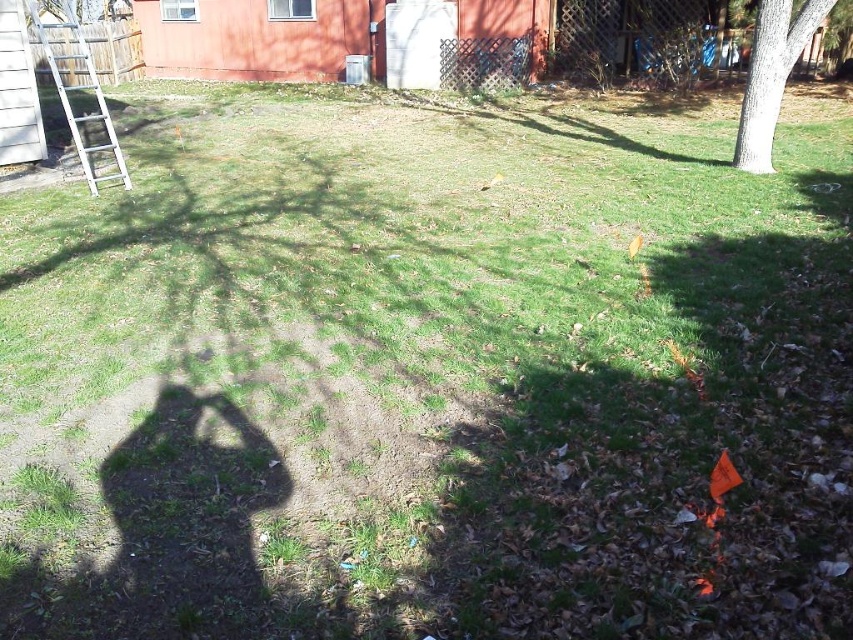
Can you confirm if white smooth tree at upper right is positioned to the right of white metallic ladder at left?

Indeed, white smooth tree at upper right is positioned on the right side of white metallic ladder at left.

Image resolution: width=853 pixels, height=640 pixels. I want to click on white smooth tree at upper right, so pyautogui.click(x=770, y=74).

This screenshot has width=853, height=640. Identify the location of white smooth tree at upper right. (770, 74).